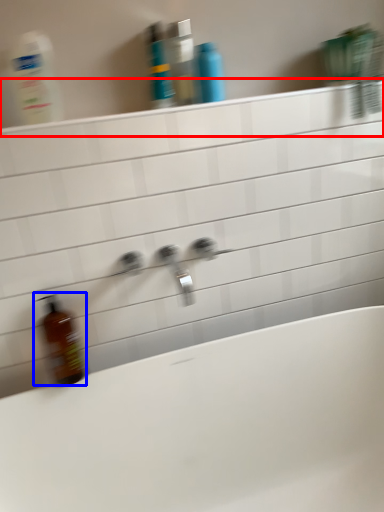
Question: Which point is closer to the camera, ledge (highlighted by a red box) or bottle (highlighted by a blue box)?

Choices:
 (A) ledge
 (B) bottle

Answer: (A)